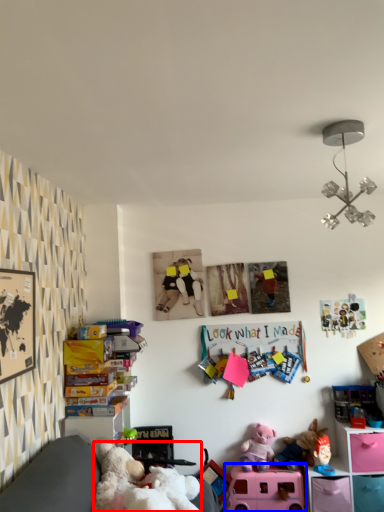
Question: Which point is further to the camera, teddy (highlighted by a red box) or toy (highlighted by a blue box)?

Choices:
 (A) teddy
 (B) toy

Answer: (B)